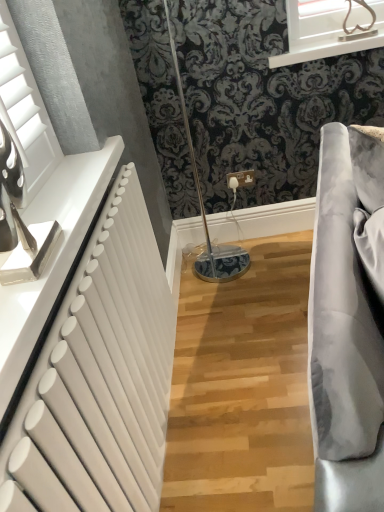
At what (x,y) coordinates should I click in order to perform the action: click on empty space that is ontop of white matte radiator at left. Please return your answer as a coordinate pair (x, y). This screenshot has width=384, height=512. Looking at the image, I should click on point(84,258).